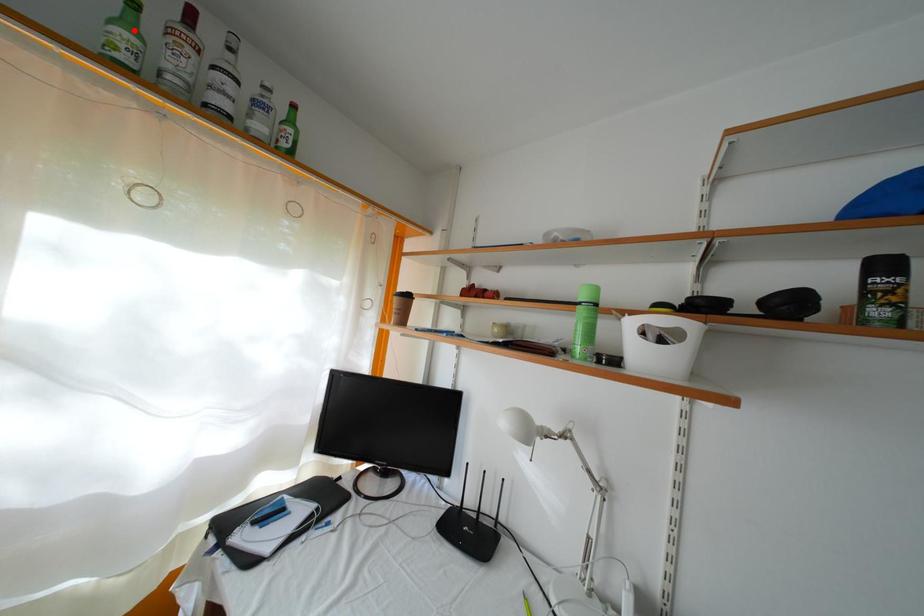
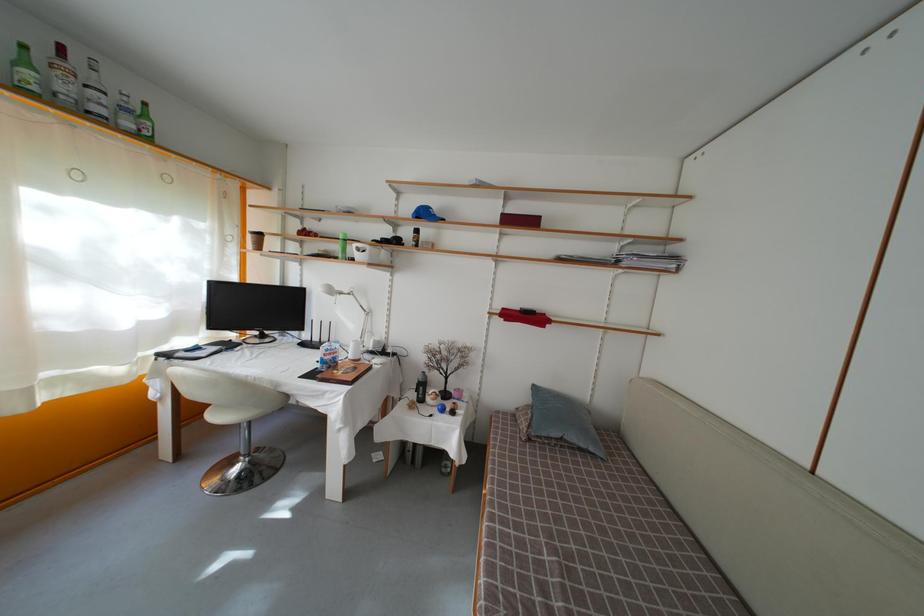
Where in the second image is the point corresponding to the highlighted location from the first image?

(31, 69)